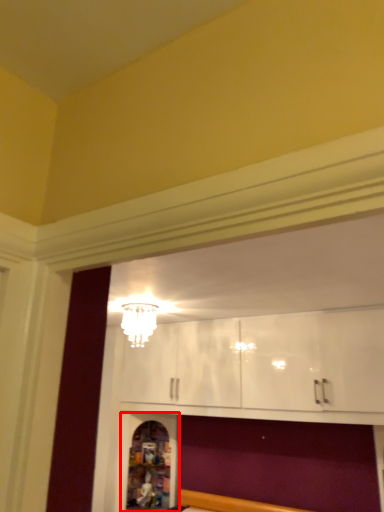
Question: From the image, what is the correct spatial relationship of shelf (annotated by the red box) in relation to light fixture?

Choices:
 (A) right
 (B) left

Answer: (B)